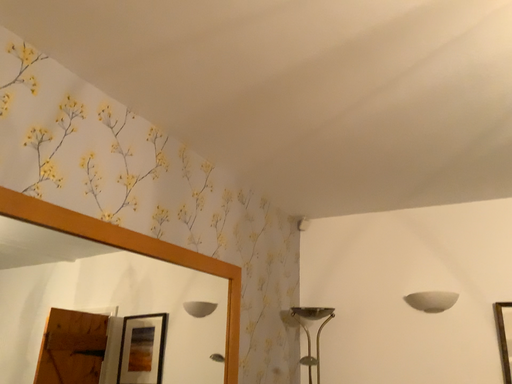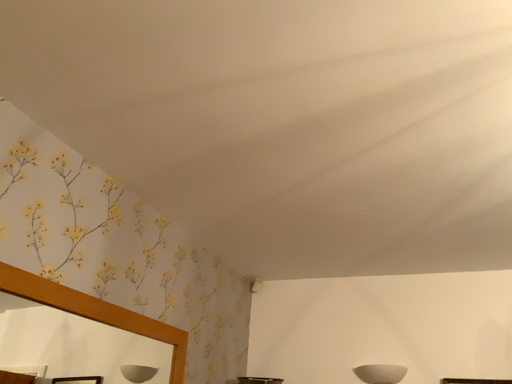
Question: How did the camera likely rotate when shooting the video?

Choices:
 (A) rotated upward
 (B) rotated downward

Answer: (A)